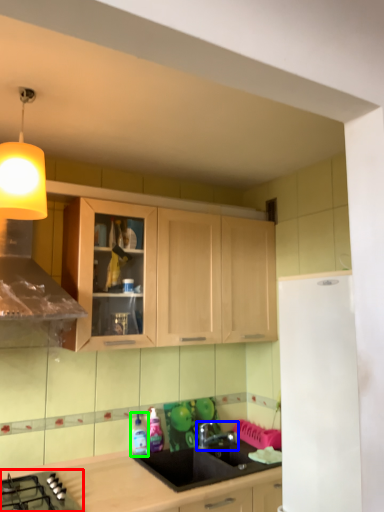
Question: Considering the real-world distances, which object is closest to gas stove (highlighted by a red box)? tap (highlighted by a blue box) or bottle (highlighted by a green box).

Choices:
 (A) tap
 (B) bottle

Answer: (B)